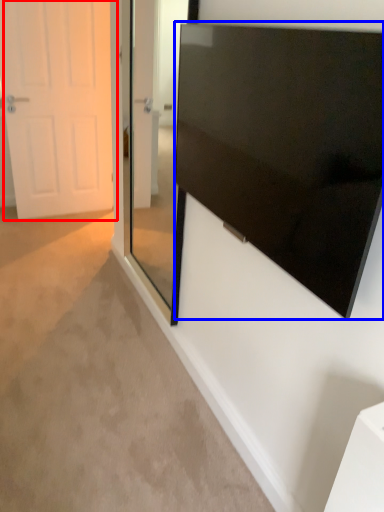
Question: Which object is further to the camera taking this photo, door (highlighted by a red box) or screen (highlighted by a blue box)?

Choices:
 (A) door
 (B) screen

Answer: (A)